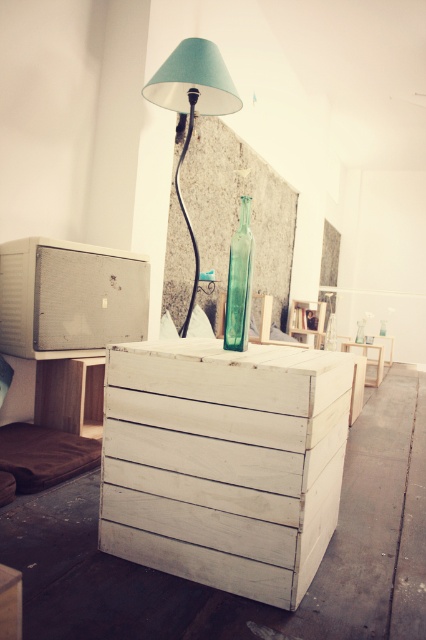
Who is more forward, (282,378) or (218,115)?

Point (282,378) is more forward.

Which is behind, point (138, 381) or point (161, 77)?

Positioned behind is point (161, 77).

Identify the location of white wood crate at center. The height and width of the screenshot is (640, 426). point(224,461).

Is white wood crate at center wider than white wood table at center?

Yes, white wood crate at center is wider than white wood table at center.

Who is positioned more to the left, white wood crate at center or white wood table at center?

white wood crate at center

Between point (112, 417) and point (374, 381), which one is positioned in front?

Point (112, 417) is in front.

This screenshot has height=640, width=426. Find the location of `white wood crate at center`. white wood crate at center is located at coordinates [224, 461].

Is white wood crate at center in front of transparent glass bottle at center?

Yes, it is in front of transparent glass bottle at center.

Is point (207, 547) farther from camera compared to point (250, 275)?

No, (207, 547) is in front of (250, 275).

What do you see at coordinates (224, 461) in the screenshot? I see `white wood crate at center` at bounding box center [224, 461].

This screenshot has height=640, width=426. Identify the location of white wood crate at center. (224, 461).